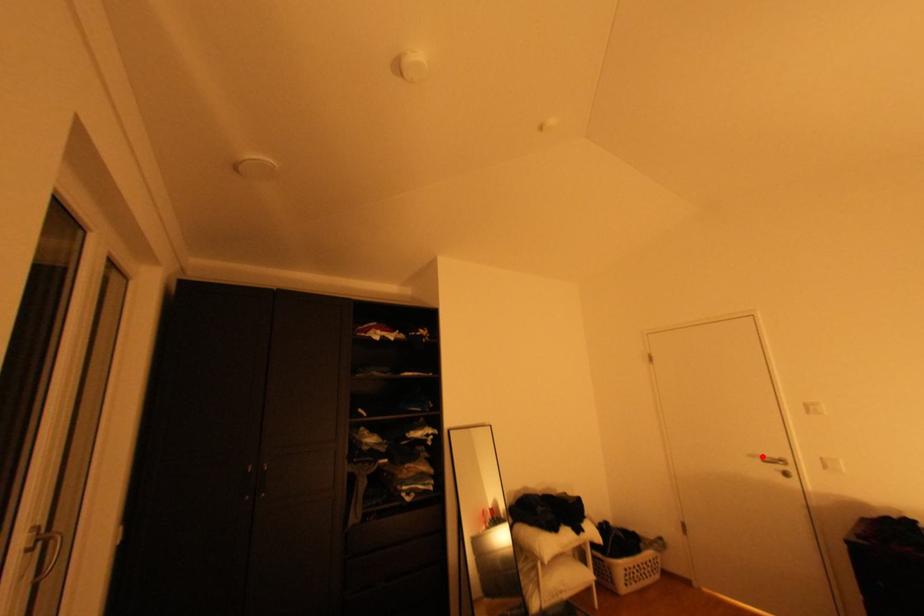
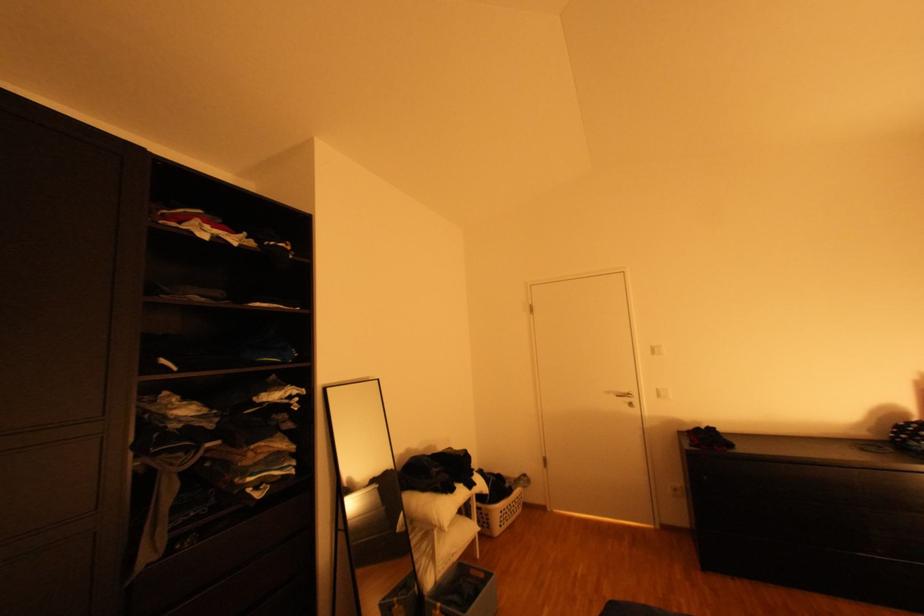
Find the pixel in the second image that matches the highlighted location in the first image.

(617, 392)